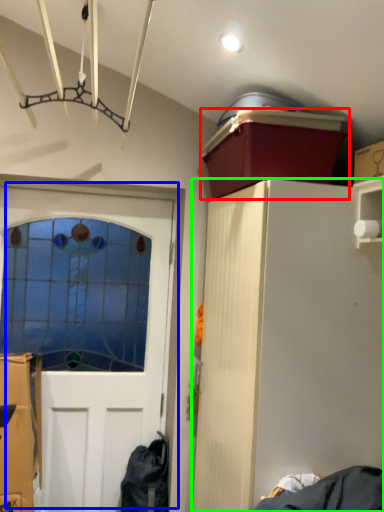
Question: Considering the real-world distances, which object is farthest from box (highlighted by a red box)? door (highlighted by a blue box) or cabinetry (highlighted by a green box)?

Choices:
 (A) door
 (B) cabinetry

Answer: (A)